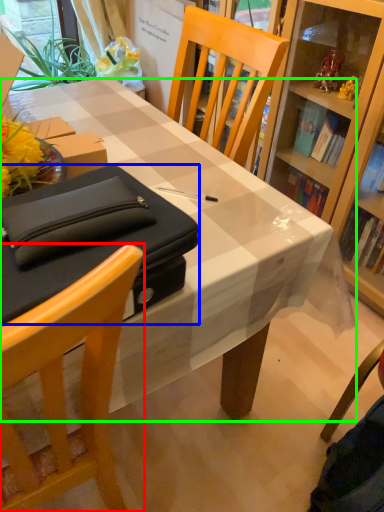
Question: Considering the real-world distances, which object is farthest from chair (highlighted by a red box)? box (highlighted by a blue box) or desk (highlighted by a green box)?

Choices:
 (A) box
 (B) desk

Answer: (B)